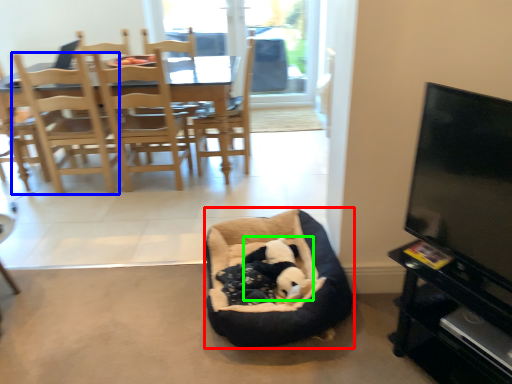
Question: Which object is positioned farthest from dog bed (highlighted by a red box)? Select from chair (highlighted by a blue box) and animal (highlighted by a green box).

Choices:
 (A) chair
 (B) animal

Answer: (A)